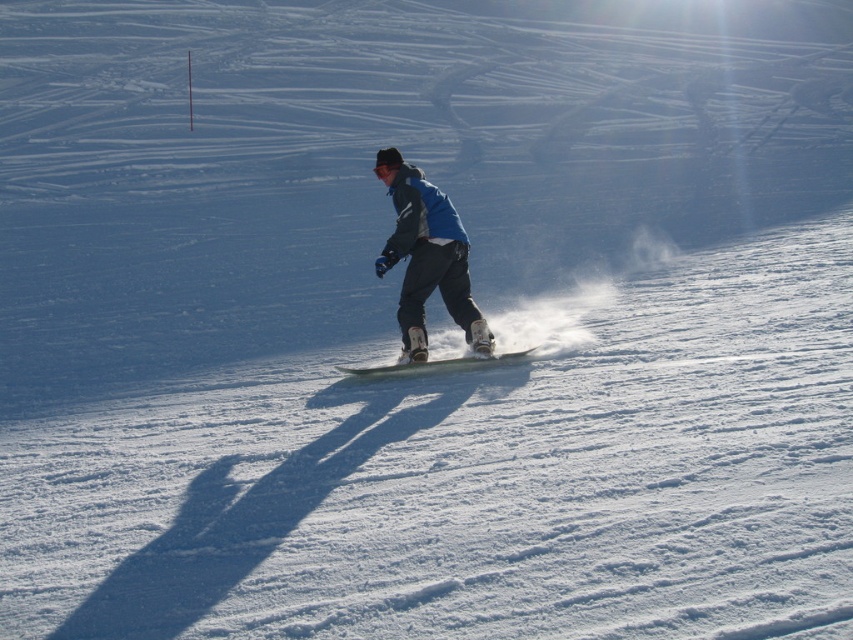
Question: Which of the following is the closest to the observer?

Choices:
 (A) (419, 218)
 (B) (393, 368)

Answer: (B)

Question: Can you confirm if matte blue snowboarder at center is positioned to the right of white matte snowboard at center?

Choices:
 (A) no
 (B) yes

Answer: (A)

Question: Which of the following is the closest to the observer?

Choices:
 (A) [x=497, y=355]
 (B) [x=402, y=209]

Answer: (B)

Question: Is matte blue snowboarder at center further to the viewer compared to white matte snowboard at center?

Choices:
 (A) no
 (B) yes

Answer: (A)

Question: Is matte blue snowboarder at center above white matte snowboard at center?

Choices:
 (A) yes
 (B) no

Answer: (A)